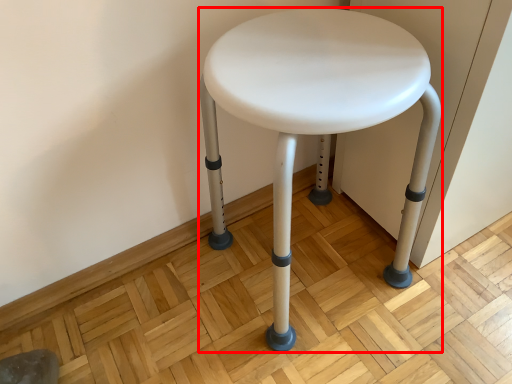
Question: From the image, what is the correct spatial relationship of stool (annotated by the red box) in relation to swivel chair?

Choices:
 (A) right
 (B) left

Answer: (A)